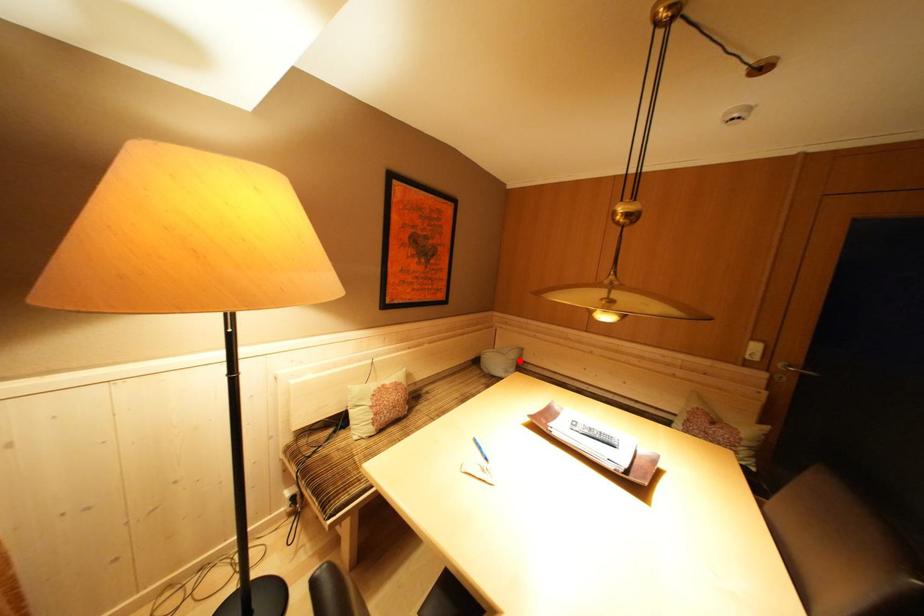
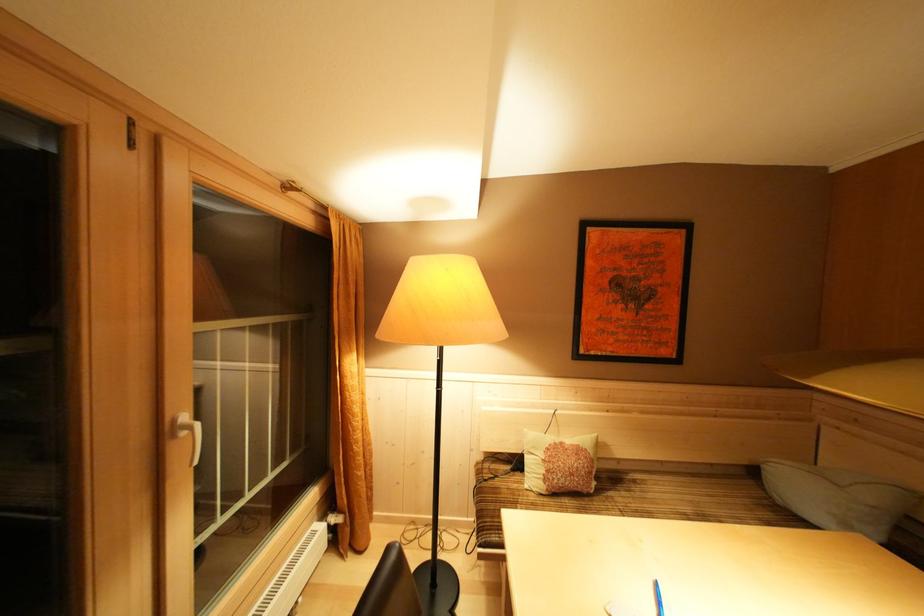
Question: A red point is marked in image1. In image2, is the corresponding 3D point closer to the camera or farther? Reply with the corresponding letter.

Choices:
 (A) The corresponding 3D point is closer.
 (B) The corresponding 3D point is farther.

Answer: (A)